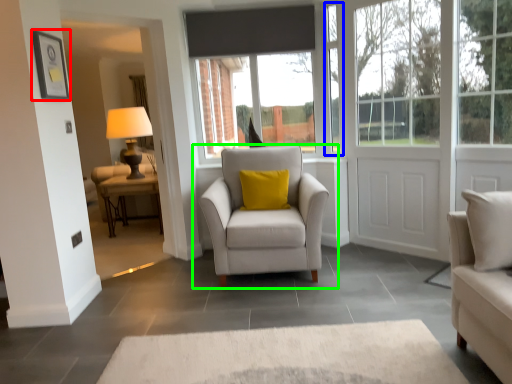
Question: Which object is positioned farthest from picture frame (highlighted by a red box)? Select from window frame (highlighted by a blue box) and chair (highlighted by a green box).

Choices:
 (A) window frame
 (B) chair

Answer: (A)